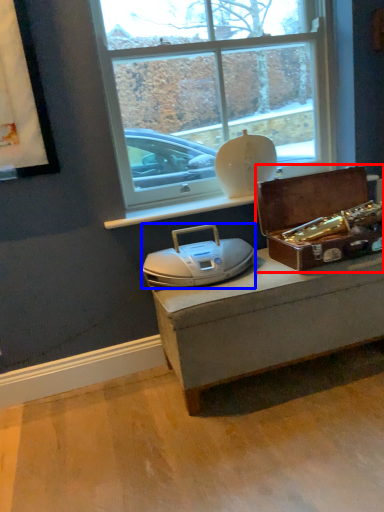
Question: Which point is closer to the camera, box (highlighted by a red box) or stereo (highlighted by a blue box)?

Choices:
 (A) box
 (B) stereo

Answer: (B)